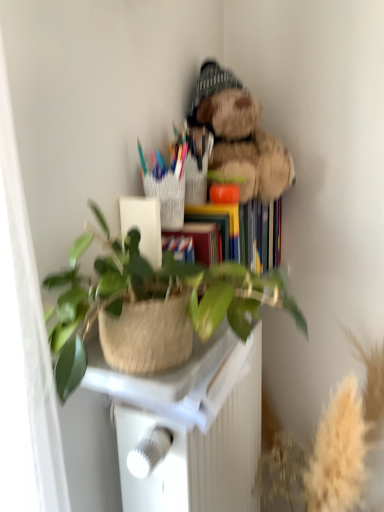
Question: Is white plastic table at center facing away from green woven basket at center?

Choices:
 (A) no
 (B) yes

Answer: (A)

Question: Considering the relative sizes of white plastic table at center and green woven basket at center in the image provided, is white plastic table at center wider than green woven basket at center?

Choices:
 (A) yes
 (B) no

Answer: (B)

Question: Are white plastic table at center and green woven basket at center far apart?

Choices:
 (A) yes
 (B) no

Answer: (B)

Question: From a real-world perspective, is white plastic table at center located higher than green woven basket at center?

Choices:
 (A) yes
 (B) no

Answer: (B)

Question: Considering the relative sizes of white plastic table at center and green woven basket at center in the image provided, is white plastic table at center shorter than green woven basket at center?

Choices:
 (A) yes
 (B) no

Answer: (B)

Question: Can you confirm if white plastic table at center is taller than green woven basket at center?

Choices:
 (A) no
 (B) yes

Answer: (B)

Question: Is white plastic table at center thinner than fuzzy brown teddy bear at upper right?

Choices:
 (A) no
 (B) yes

Answer: (B)

Question: Considering the relative sizes of white plastic table at center and fuzzy brown teddy bear at upper right in the image provided, is white plastic table at center shorter than fuzzy brown teddy bear at upper right?

Choices:
 (A) no
 (B) yes

Answer: (A)

Question: Would you say fuzzy brown teddy bear at upper right is part of white plastic table at center's contents?

Choices:
 (A) yes
 (B) no

Answer: (B)

Question: From a real-world perspective, is white plastic table at center beneath fuzzy brown teddy bear at upper right?

Choices:
 (A) no
 (B) yes

Answer: (B)

Question: From a real-world perspective, is white plastic table at center physically above fuzzy brown teddy bear at upper right?

Choices:
 (A) no
 (B) yes

Answer: (A)

Question: Is white plastic table at center positioned with its back to fuzzy brown teddy bear at upper right?

Choices:
 (A) yes
 (B) no

Answer: (B)

Question: From a real-world perspective, is green woven basket at center on top of fuzzy brown teddy bear at upper right?

Choices:
 (A) no
 (B) yes

Answer: (A)